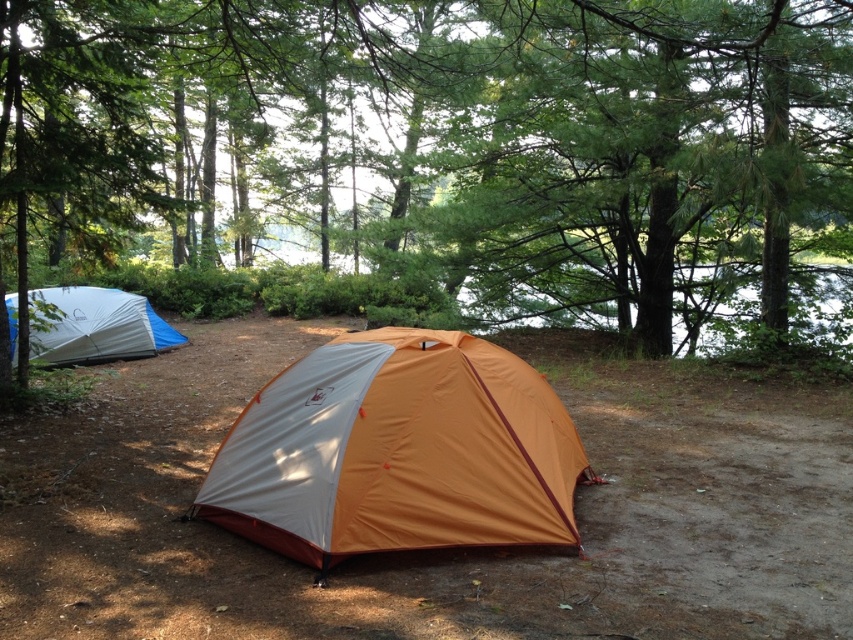
Is green leafy tree at center in front of orange nylon tent at center?

That is False.

Looking at this image, does green leafy tree at center appear on the right side of orange nylon tent at center?

In fact, green leafy tree at center is to the left of orange nylon tent at center.

Describe the element at coordinates (451, 156) in the screenshot. I see `green leafy tree at center` at that location.

At what (x,y) coordinates should I click in order to perform the action: click on green leafy tree at center. Please return your answer as a coordinate pair (x, y). This screenshot has width=853, height=640. Looking at the image, I should click on [x=451, y=156].

From the picture: Can you confirm if green leafy tree at center is positioned above blue tarp tent at left?

Yes.

Measure the distance between green leafy tree at center and camera.

green leafy tree at center is 4.31 meters from camera.

Who is more forward, (514, 195) or (114, 323)?

Positioned in front is point (114, 323).

This screenshot has width=853, height=640. I want to click on green leafy tree at center, so click(x=451, y=156).

Can you confirm if orange nylon tent at center is smaller than blue tarp tent at left?

Indeed, orange nylon tent at center has a smaller size compared to blue tarp tent at left.

Between point (503, 428) and point (160, 337), which one is positioned in front?

Point (503, 428)

The image size is (853, 640). What are the coordinates of `orange nylon tent at center` in the screenshot? It's located at (398, 451).